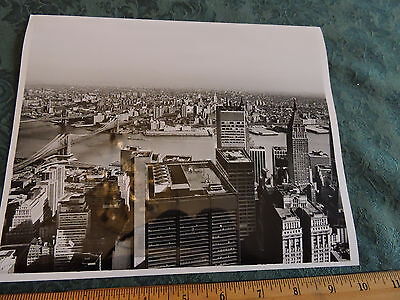
The height and width of the screenshot is (300, 400). I want to click on 1 partial ruler, so click(377, 286).